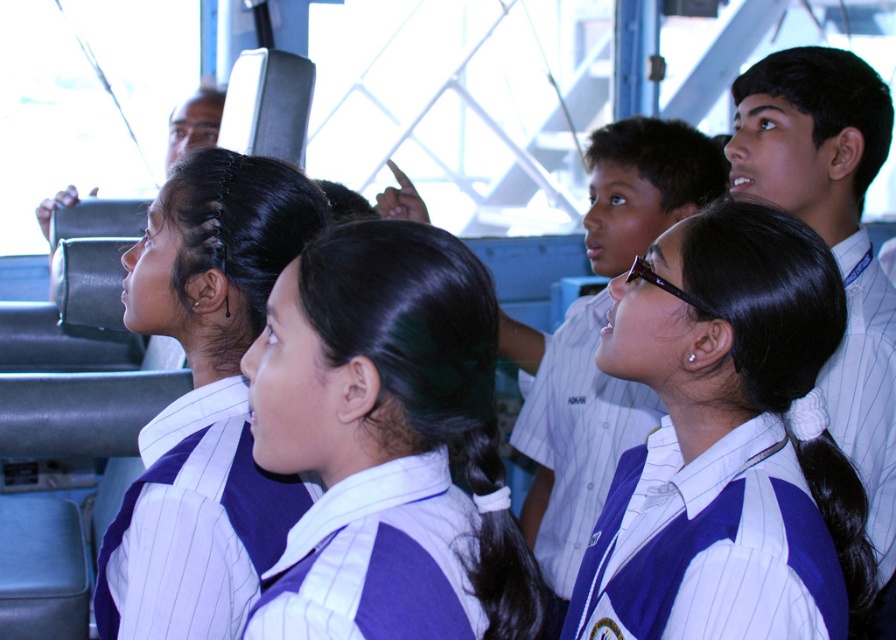
Question: Which object is farther from the camera taking this photo?

Choices:
 (A) black silky hair at upper right
 (B) white striped fabric at center

Answer: (A)

Question: Is blue pinstriped baseball uniform at center to the right of black silky hair at upper right from the viewer's perspective?

Choices:
 (A) no
 (B) yes

Answer: (A)

Question: Where is blue striped shirt at center located in relation to white striped fabric at center in the image?

Choices:
 (A) below
 (B) above

Answer: (B)

Question: Observing the image, what is the correct spatial positioning of blue pinstriped baseball uniform at center in reference to black silky hair at center?

Choices:
 (A) above
 (B) below

Answer: (B)

Question: Which of the following is the closest to the observer?

Choices:
 (A) black silky hair at upper right
 (B) blue striped uniform at center

Answer: (B)

Question: Which object is the closest to the blue pinstriped baseball uniform at center?

Choices:
 (A) blue striped shirt at center
 (B) white pinstriped shirt at center
 (C) black silky hair at center
 (D) blue striped uniform at center

Answer: (A)